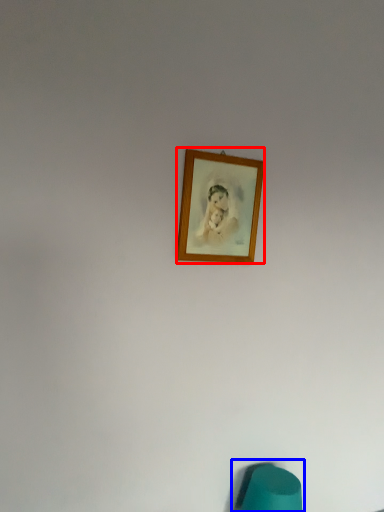
Question: Which point is closer to the camera, picture frame (highlighted by a red box) or bean bag chair (highlighted by a blue box)?

Choices:
 (A) picture frame
 (B) bean bag chair

Answer: (A)